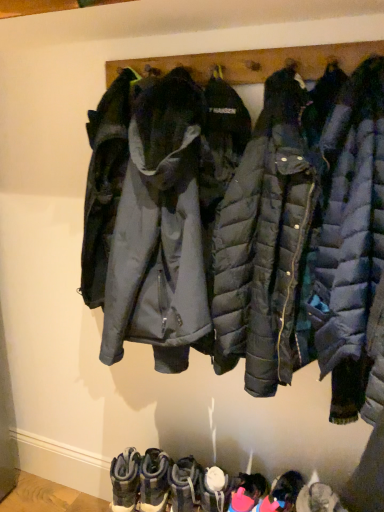
Question: Should I look upward or downward to see leather suede boots at lower center, the fourth footwear from the right?

Choices:
 (A) up
 (B) down

Answer: (B)

Question: Is pink fabric boot at lower center, which ranks as the second footwear in right-to-left order, positioned behind matte black puffer jacket at center?

Choices:
 (A) yes
 (B) no

Answer: (A)

Question: Is pink fabric boot at lower center, positioned as the 5th footwear in left-to-right order, shorter than matte black puffer jacket at center?

Choices:
 (A) no
 (B) yes

Answer: (B)

Question: Considering the relative sizes of pink fabric boot at lower center, which ranks as the second footwear in right-to-left order, and matte black puffer jacket at center in the image provided, is pink fabric boot at lower center, which ranks as the second footwear in right-to-left order, thinner than matte black puffer jacket at center?

Choices:
 (A) yes
 (B) no

Answer: (A)

Question: Can you confirm if pink fabric boot at lower center, positioned as the 5th footwear in left-to-right order, is wider than matte black puffer jacket at center?

Choices:
 (A) yes
 (B) no

Answer: (B)

Question: From a real-world perspective, is pink fabric boot at lower center, positioned as the 5th footwear in left-to-right order, below matte black puffer jacket at center?

Choices:
 (A) no
 (B) yes

Answer: (B)

Question: Is pink fabric boot at lower center, which ranks as the second footwear in right-to-left order, far from matte black puffer jacket at center?

Choices:
 (A) yes
 (B) no

Answer: (B)

Question: Does pink fabric boot at lower center, which ranks as the second footwear in right-to-left order, have a larger size compared to pink fabric boots at lower center, arranged as the sixth footwear when viewed from the left?

Choices:
 (A) yes
 (B) no

Answer: (B)

Question: Is the position of pink fabric boot at lower center, which ranks as the second footwear in right-to-left order, more distant than that of pink fabric boots at lower center, which is the 1th footwear from right to left?

Choices:
 (A) no
 (B) yes

Answer: (B)

Question: Does pink fabric boot at lower center, positioned as the 5th footwear in left-to-right order, appear on the left side of pink fabric boots at lower center, which is the 1th footwear from right to left?

Choices:
 (A) no
 (B) yes

Answer: (B)

Question: Considering the relative sizes of pink fabric boot at lower center, positioned as the 5th footwear in left-to-right order, and pink fabric boots at lower center, which is the 1th footwear from right to left, in the image provided, is pink fabric boot at lower center, positioned as the 5th footwear in left-to-right order, shorter than pink fabric boots at lower center, which is the 1th footwear from right to left,?

Choices:
 (A) no
 (B) yes

Answer: (B)

Question: Is pink fabric boot at lower center, positioned as the 5th footwear in left-to-right order, with pink fabric boots at lower center, which is the 1th footwear from right to left?

Choices:
 (A) yes
 (B) no

Answer: (A)

Question: Is pink fabric boot at lower center, positioned as the 5th footwear in left-to-right order, positioned with its back to pink fabric boots at lower center, which is the 1th footwear from right to left?

Choices:
 (A) yes
 (B) no

Answer: (B)

Question: Is the surface of white matte boot at lower center, the 4th footwear from the left, in direct contact with matte black puffer jacket at center?

Choices:
 (A) no
 (B) yes

Answer: (A)